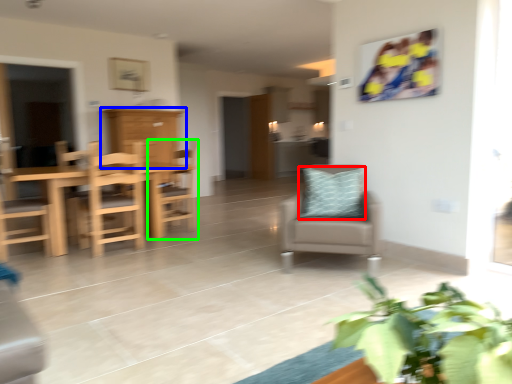
Question: Considering the real-world distances, which object is farthest from pillow (highlighted by a red box)? cabinetry (highlighted by a blue box) or chair (highlighted by a green box)?

Choices:
 (A) cabinetry
 (B) chair

Answer: (A)